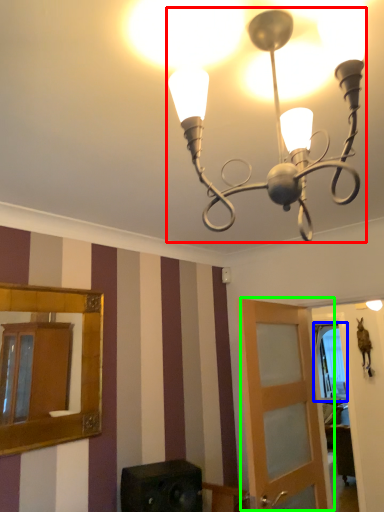
Question: Considering the real-world distances, which object is farthest from lamp (highlighted by a red box)? window (highlighted by a blue box) or door (highlighted by a green box)?

Choices:
 (A) window
 (B) door

Answer: (A)